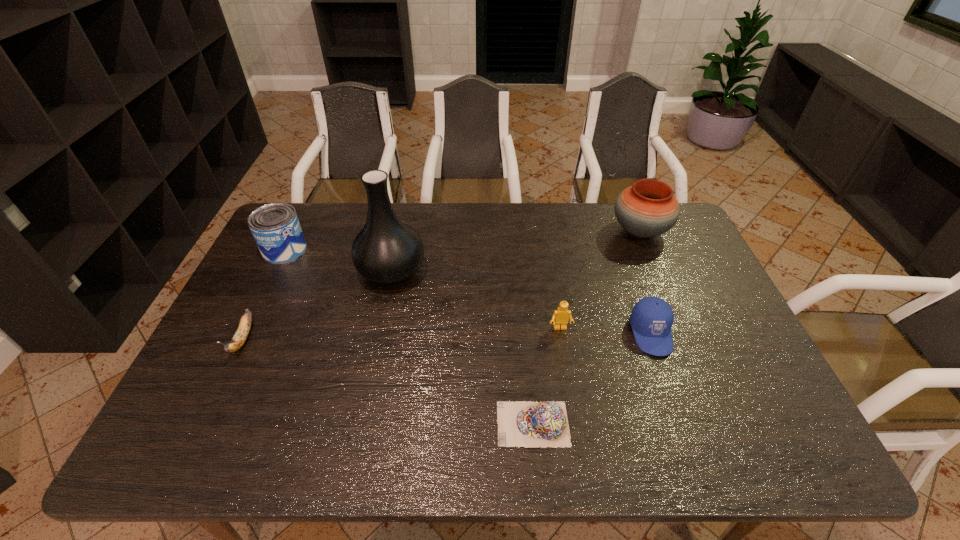
The image size is (960, 540). I want to click on unoccupied area between the banana and the right cap, so click(x=447, y=336).

You are a GUI agent. You are given a task and a screenshot of the screen. Output one action in this format:
    pyautogui.click(x=<x>, y=<y>)
    Task: Click on the third closest object to the pottery
    The width and height of the screenshot is (960, 540).
    Given the screenshot: What is the action you would take?
    click(x=529, y=424)

Locate which object is the fourth closest to the fifth shortest object. Please provide its 2D coordinates. Your answer should be formatted as a tuple, i.e. [(x, y)], where the tuple contains the x and y coordinates of a point satisfying the conditions above.

[(560, 318)]